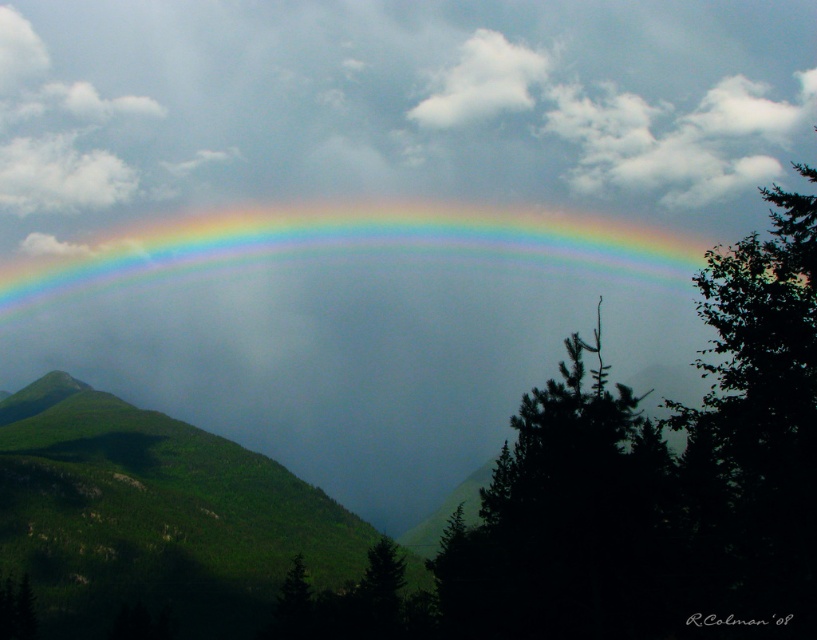
Is white fluffy cloud at upper left shorter than white fluffy cloud at upper center?

Yes.

Who is lower down, white fluffy cloud at upper left or white fluffy cloud at upper center?

Positioned lower is white fluffy cloud at upper left.

Is point (0, 182) less distant than point (414, 108)?

No, it is behind (414, 108).

I want to click on white fluffy cloud at upper left, so click(x=60, y=176).

Which is behind, point (432, 224) or point (21, 179)?

Positioned behind is point (21, 179).

Can you confirm if rainbow at center is positioned to the left of white fluffy cloud at upper left?

No, rainbow at center is not to the left of white fluffy cloud at upper left.

This screenshot has height=640, width=817. Describe the element at coordinates (350, 243) in the screenshot. I see `rainbow at center` at that location.

You are a GUI agent. You are given a task and a screenshot of the screen. Output one action in this format:
    pyautogui.click(x=<x>, y=<y>)
    Task: Click on the rainbow at center
    
    Given the screenshot: What is the action you would take?
    pyautogui.click(x=350, y=243)

Is green grassy hillside at lower left smaller than green matte tree at center?

Incorrect, green grassy hillside at lower left is not smaller in size than green matte tree at center.

Image resolution: width=817 pixels, height=640 pixels. Describe the element at coordinates (154, 516) in the screenshot. I see `green grassy hillside at lower left` at that location.

The width and height of the screenshot is (817, 640). In order to click on green grassy hillside at lower left in this screenshot , I will do 154,516.